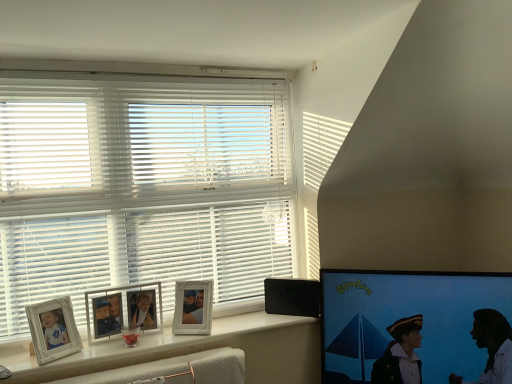
You are a GUI agent. You are given a task and a screenshot of the screen. Output one action in this format:
    pyautogui.click(x=<x>, y=<y>)
    Task: Click on the free spot in front of white wooden picture frame at lower left, the 1th picture frame viewed from the left
    The image size is (512, 384).
    Given the screenshot: What is the action you would take?
    pyautogui.click(x=105, y=350)